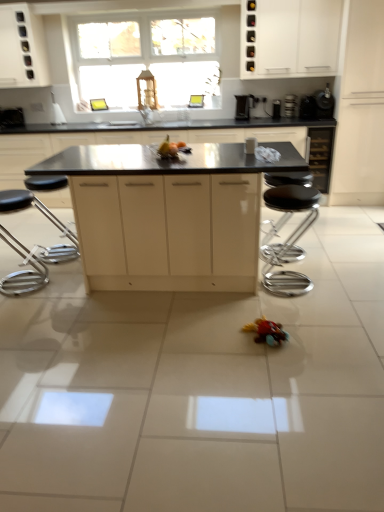
Question: Is black glossy coffee maker at upper right, which ranks as the third appliance in back-to-front order, to the left or to the right of rubberized red toy car at lower center, the 1th toy positioned from the front, in the image?

Choices:
 (A) left
 (B) right

Answer: (B)

Question: In terms of height, does black glossy coffee maker at upper right, the first appliance positioned from the front, look taller or shorter compared to rubberized red toy car at lower center, the 2th toy positioned from the left?

Choices:
 (A) tall
 (B) short

Answer: (A)

Question: Estimate the real-world distances between objects in this image. Which object is closer to the black glossy coffee maker at upper right, which ranks as the third appliance in back-to-front order?

Choices:
 (A) rubberized red toy car at lower center, the 1th toy positioned from the front
 (B) black matte island at center, positioned as the fifth cabinetry in right-to-left order
 (C) matte yellow fruit at center, positioned as the first toy in left-to-right order
 (D) polished chrome bar stool at left, which ranks as the 2th bar stool in right-to-left order
 (E) yellow matte fruit at center

Answer: (B)

Question: Which of these objects is positioned closest to the black glass wine cabinet at right, the 2th cabinetry in the right-to-left sequence?

Choices:
 (A) white matte cabinet at right, arranged as the 6th cabinetry when viewed from the left
 (B) metallic silver wine cooler at upper right, positioned as the second appliance in back-to-front order
 (C) black glossy coffee maker at upper right, the third appliance positioned from the left
 (D) rubberized red toy car at lower center, the 1th toy positioned from the front
 (E) white matte cabinet at upper right, which appears as the third cabinetry when viewed from the right

Answer: (C)